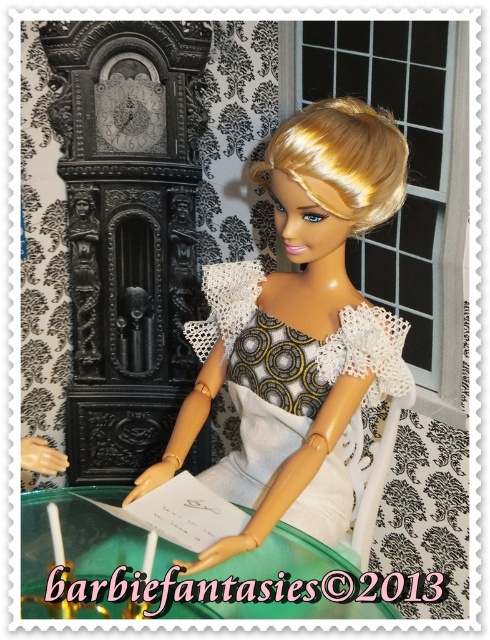
Question: In this image, where is matte white dress at center located relative to patterned fabric dress at center?

Choices:
 (A) right
 (B) left

Answer: (B)

Question: Observing the image, what is the correct spatial positioning of matte white dress at center in reference to patterned fabric dress at center?

Choices:
 (A) right
 (B) left

Answer: (B)

Question: Which object appears closest to the camera in this image?

Choices:
 (A) patterned fabric dress at center
 (B) matte white dress at center

Answer: (B)

Question: Is matte white dress at center to the left of patterned fabric dress at center from the viewer's perspective?

Choices:
 (A) no
 (B) yes

Answer: (B)